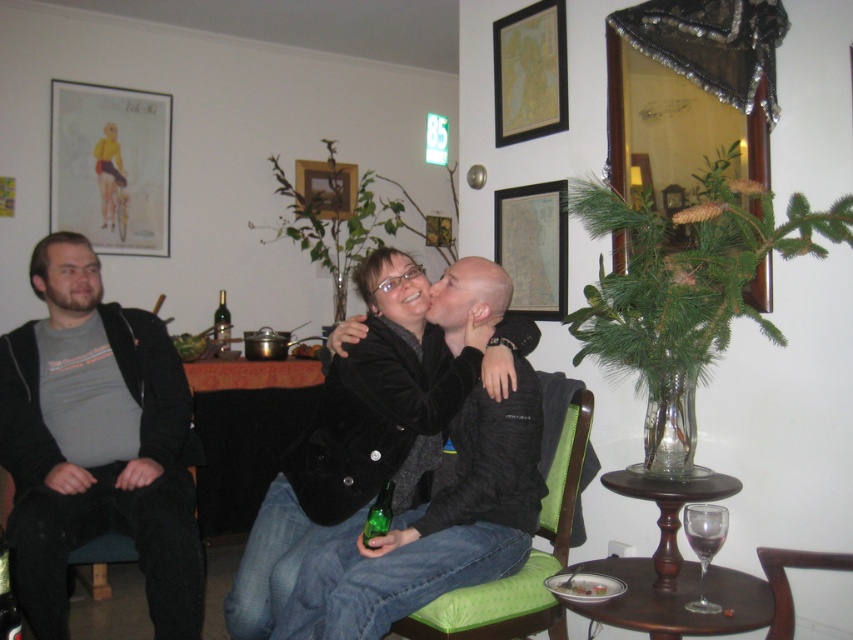
Question: Observing the image, what is the correct spatial positioning of brown leather armchair at lower right in reference to green glass bottle at lower center?

Choices:
 (A) right
 (B) left

Answer: (A)

Question: Is green fabric armchair at center thinner than green glass bottle at lower center?

Choices:
 (A) no
 (B) yes

Answer: (A)

Question: Which point appears farthest from the camera in this image?

Choices:
 (A) (213, 332)
 (B) (453, 616)
 (C) (80, 419)

Answer: (A)

Question: Which point is closer to the camera?

Choices:
 (A) green glass bottle at lower center
 (B) green fabric armchair at center

Answer: (B)

Question: Does matte gray shirt at left lie behind green fabric armchair at center?

Choices:
 (A) no
 (B) yes

Answer: (B)

Question: Which point is closer to the camera taking this photo?

Choices:
 (A) (376, 509)
 (B) (550, 390)

Answer: (A)